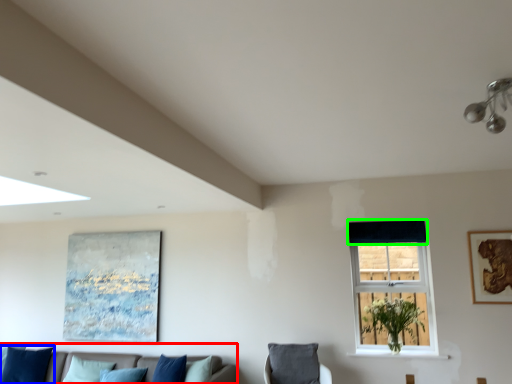
Question: Which is farther away from studio couch (highlighted by a red box)? pillow (highlighted by a blue box) or curtain (highlighted by a green box)?

Choices:
 (A) pillow
 (B) curtain

Answer: (B)